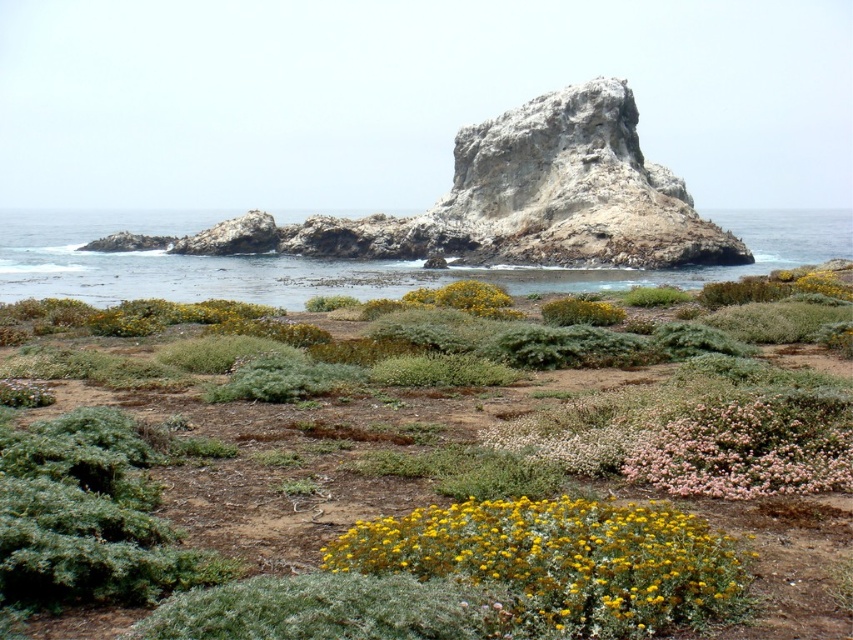
Does blue water at center appear over pink fluffy bush at lower right?

Indeed, blue water at center is positioned over pink fluffy bush at lower right.

Does blue water at center have a greater width compared to pink fluffy bush at lower right?

Indeed, blue water at center has a greater width compared to pink fluffy bush at lower right.

Between point (25, 212) and point (660, 449), which one is positioned behind?

Point (25, 212)

Locate an element on the screen. Image resolution: width=853 pixels, height=640 pixels. blue water at center is located at coordinates (346, 260).

In the scene shown: Can you confirm if yellow matte flower at lower center is thinner than blue water at center?

Yes, yellow matte flower at lower center is thinner than blue water at center.

Between yellow matte flower at lower center and blue water at center, which one is positioned lower?

yellow matte flower at lower center is lower down.

This screenshot has width=853, height=640. I want to click on yellow matte flower at lower center, so pyautogui.click(x=563, y=563).

Is yellow matte flower at lower center to the left of pink fluffy bush at lower right from the viewer's perspective?

Yes, yellow matte flower at lower center is to the left of pink fluffy bush at lower right.

From the picture: Who is higher up, yellow matte flower at lower center or pink fluffy bush at lower right?

pink fluffy bush at lower right is above.

Is point (590, 556) more distant than point (671, 451)?

No, (590, 556) is in front of (671, 451).

This screenshot has width=853, height=640. In order to click on yellow matte flower at lower center in this screenshot , I will do `click(563, 563)`.